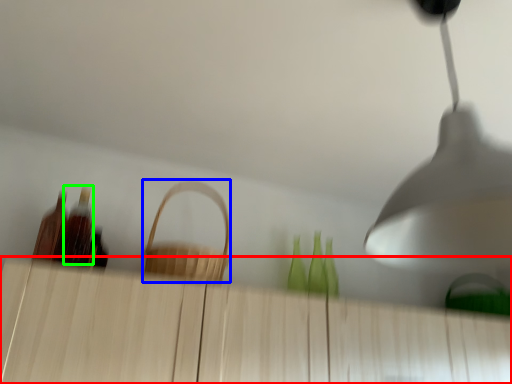
Question: Considering the real-world distances, which object is farthest from dresser (highlighted by a red box)? basket (highlighted by a blue box) or bottle (highlighted by a green box)?

Choices:
 (A) basket
 (B) bottle

Answer: (B)